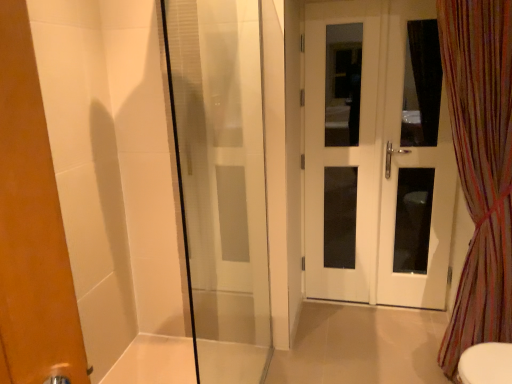
In order to face white glossy door at right, should I rotate leftwards or rightwards?

To align with it, rotate right about 16.335°.

This screenshot has height=384, width=512. Identify the location of white glass door at right, the 1th screen door positioned from the right. (414, 167).

What do you see at coordinates (342, 143) in the screenshot?
I see `white glossy door at center, the second screen door positioned from the right` at bounding box center [342, 143].

At what (x,y) coordinates should I click in order to perform the action: click on white glossy door at center, the 1th screen door from the left. Please return your answer as a coordinate pair (x, y). This screenshot has width=512, height=384. Looking at the image, I should click on point(342,143).

Where is `multicolored striped curtain at right`? This screenshot has height=384, width=512. multicolored striped curtain at right is located at coordinates (480, 167).

Considering the points (376, 88) and (216, 379), which point is in front, point (376, 88) or point (216, 379)?

The point (216, 379) is in front.

Does white glossy door at center, the second screen door positioned from the right, touch transparent glass shower door at left?

No, white glossy door at center, the second screen door positioned from the right, is not making contact with transparent glass shower door at left.

Considering the relative positions of white glossy door at center, the 1th screen door from the left, and transparent glass shower door at left in the image provided, is white glossy door at center, the 1th screen door from the left, to the right of transparent glass shower door at left from the viewer's perspective?

Indeed, white glossy door at center, the 1th screen door from the left, is positioned on the right side of transparent glass shower door at left.

How different are the orientations of white glossy door at center, the 1th screen door from the left, and transparent glass shower door at left in degrees?

89.4 degrees separate the facing orientations of white glossy door at center, the 1th screen door from the left, and transparent glass shower door at left.

From their relative heights in the image, would you say white glossy door at right is taller or shorter than white glass door at right, the 1th screen door positioned from the right?

white glossy door at right is taller than white glass door at right, the 1th screen door positioned from the right.

Between white glossy door at right and white glass door at right, the 1th screen door positioned from the right, which one has smaller size?

Smaller between the two is white glass door at right, the 1th screen door positioned from the right.

From the image's perspective, is white glossy door at right above or below white glass door at right, the 1th screen door positioned from the right?

white glossy door at right is situated higher than white glass door at right, the 1th screen door positioned from the right, in the image.

Is white glossy door at right aimed at white glass door at right, which ranks as the second screen door in left-to-right order?

Yes, white glossy door at right is facing white glass door at right, which ranks as the second screen door in left-to-right order.

Which object is closer to the camera taking this photo, transparent glass shower door at left or multicolored striped curtain at right?

transparent glass shower door at left is closer to the camera.

How many degrees apart are the facing directions of transparent glass shower door at left and multicolored striped curtain at right?

The angular difference between transparent glass shower door at left and multicolored striped curtain at right is 88.5 degrees.

Which of these two, transparent glass shower door at left or multicolored striped curtain at right, is wider?

multicolored striped curtain at right is wider.

From a real-world perspective, which is physically above, transparent glass shower door at left or multicolored striped curtain at right?

transparent glass shower door at left is physically above.

Is white glossy door at center, the second screen door positioned from the right, far from multicolored striped curtain at right?

white glossy door at center, the second screen door positioned from the right, is actually quite close to multicolored striped curtain at right.

How different are the orientations of white glossy door at center, the second screen door positioned from the right, and multicolored striped curtain at right in degrees?

They differ by 0.855 degrees in their facing directions.

Is white glossy door at center, the second screen door positioned from the right, oriented towards multicolored striped curtain at right?

No, white glossy door at center, the second screen door positioned from the right, is not turned towards multicolored striped curtain at right.

Does white glossy door at center, the 1th screen door from the left, have a greater height compared to multicolored striped curtain at right?

Yes.

From the image's perspective, does white glossy door at center, the second screen door positioned from the right, appear higher than white glossy door at right?

No, from the image's perspective, white glossy door at center, the second screen door positioned from the right, is not over white glossy door at right.

Where is `screen door behind the white glossy door at right`? screen door behind the white glossy door at right is located at coordinates (342, 143).

From their relative heights in the image, would you say white glossy door at center, the second screen door positioned from the right, is taller or shorter than white glossy door at right?

Considering their sizes, white glossy door at center, the second screen door positioned from the right, has less height than white glossy door at right.

Does point (330, 128) come farther from viewer compared to point (311, 273)?

That is False.

Is there a large distance between white glossy door at right and transparent glass shower door at left?

No, there isn't a large distance between white glossy door at right and transparent glass shower door at left.

Does white glossy door at right have a larger size compared to transparent glass shower door at left?

Actually, white glossy door at right might be smaller than transparent glass shower door at left.

Relative to transparent glass shower door at left, is white glossy door at right in front or behind?

Clearly, white glossy door at right is behind transparent glass shower door at left.

Consider the image. Do you think multicolored striped curtain at right is within transparent glass shower door at left, or outside of it?

The correct answer is: outside.

Considering the points (486, 80) and (244, 37), which point is behind, point (486, 80) or point (244, 37)?

The point (244, 37) is more distant.

Identify the location of shower door below the white glossy door at center, the 1th screen door from the left (from the image's perspective). (221, 182).

Where is `door behind the white glass door at right, which ranks as the second screen door in left-to-right order`? Image resolution: width=512 pixels, height=384 pixels. door behind the white glass door at right, which ranks as the second screen door in left-to-right order is located at coordinates (376, 155).

Which object lies nearer to the anchor point white glossy door at center, the second screen door positioned from the right, multicolored striped curtain at right or white glass door at right, which ranks as the second screen door in left-to-right order?

white glass door at right, which ranks as the second screen door in left-to-right order, is closer to white glossy door at center, the second screen door positioned from the right.

Looking at the image, which one is located closer to transparent glass shower door at left, white glossy door at center, the 1th screen door from the left, or white glossy door at right?

white glossy door at center, the 1th screen door from the left, is positioned closer to the anchor transparent glass shower door at left.

From the image, which object appears to be nearer to white glossy door at center, the second screen door positioned from the right, white glossy door at right or white glass door at right, which ranks as the second screen door in left-to-right order?

white glossy door at right lies closer to white glossy door at center, the second screen door positioned from the right, than the other object.

Which object lies nearer to the anchor point white glass door at right, the 1th screen door positioned from the right, transparent glass shower door at left or white glossy door at center, the 1th screen door from the left?

white glossy door at center, the 1th screen door from the left, is positioned closer to the anchor white glass door at right, the 1th screen door positioned from the right.

Looking at the image, which one is located closer to multicolored striped curtain at right, white glossy door at right or white glass door at right, the 1th screen door positioned from the right?

white glass door at right, the 1th screen door positioned from the right, is positioned closer to the anchor multicolored striped curtain at right.

Based on their spatial positions, is white glossy door at center, the 1th screen door from the left, or white glass door at right, which ranks as the second screen door in left-to-right order, further from transparent glass shower door at left?

white glass door at right, which ranks as the second screen door in left-to-right order, is further to transparent glass shower door at left.

Which object lies further to the anchor point white glossy door at right, transparent glass shower door at left or white glossy door at center, the 1th screen door from the left?

The object further to white glossy door at right is transparent glass shower door at left.

Which object lies further to the anchor point multicolored striped curtain at right, transparent glass shower door at left or white glossy door at right?

Based on the image, transparent glass shower door at left appears to be further to multicolored striped curtain at right.

Locate an element on the screen. This screenshot has width=512, height=384. screen door between transparent glass shower door at left and white glossy door at right along the z-axis is located at coordinates (414, 167).

Where is `door between multicolored striped curtain at right and white glossy door at center, the second screen door positioned from the right, in the front-back direction`? The width and height of the screenshot is (512, 384). door between multicolored striped curtain at right and white glossy door at center, the second screen door positioned from the right, in the front-back direction is located at coordinates (376, 155).

Image resolution: width=512 pixels, height=384 pixels. Find the location of `curtain between transparent glass shower door at left and white glossy door at center, the second screen door positioned from the right, along the z-axis`. curtain between transparent glass shower door at left and white glossy door at center, the second screen door positioned from the right, along the z-axis is located at coordinates (480, 167).

Image resolution: width=512 pixels, height=384 pixels. Find the location of `door between white glossy door at center, the second screen door positioned from the right, and white glass door at right, the 1th screen door positioned from the right`. door between white glossy door at center, the second screen door positioned from the right, and white glass door at right, the 1th screen door positioned from the right is located at coordinates (376, 155).